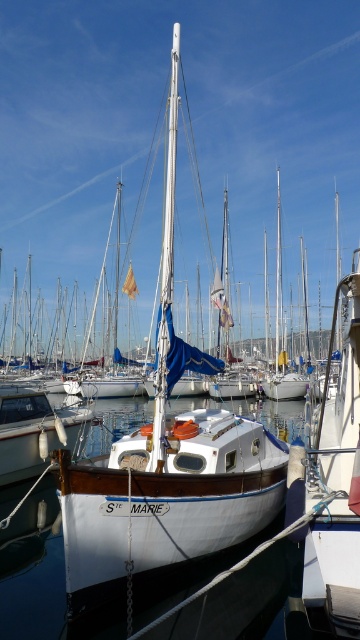
You are a dock worker who needs to secure both the white wood sailboat at center and the white matte sailboat at center to the dock. The ropes you have are 2 meters long. Can you tie both boats securely with the ropes you have?

The white wood sailboat at center and the white matte sailboat at center are 2.23 meters apart from each other. Since the ropes are only 2 meters long, they are not long enough to reach between the two boats. You will need longer ropes to secure both boats properly.

You are a photographer positioned at the dock and want to capture both the white wood sailboat at center and the white matte sailboat at center in a single shot. Which boat should you position closer to the left side of your camera frame to include both?

You should position the white wood sailboat at center closer to the left side of your camera frame since it is already to the left of the white matte sailboat at center.